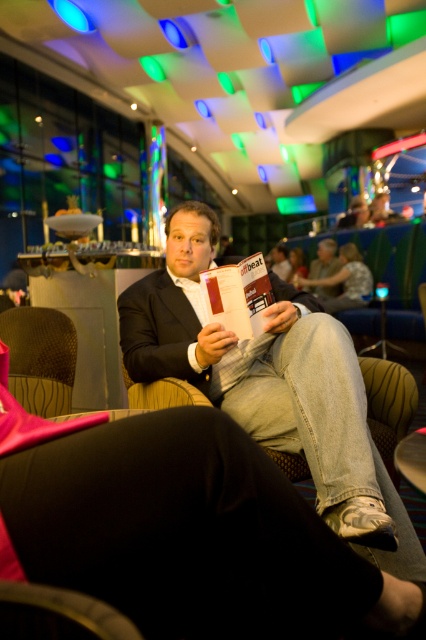
Question: Does matte black jacket at center lie in front of brown textured armchair at lower left?

Choices:
 (A) yes
 (B) no

Answer: (A)

Question: Which object is positioned closest to the red matte magazine at center?

Choices:
 (A) light brown leather jacket at center
 (B) metallic gold chair at lower left
 (C) matte black jacket at center
 (D) brown textured armchair at lower left

Answer: (C)

Question: Is brown textured armchair at lower left to the right of metallic gold chair at lower left from the viewer's perspective?

Choices:
 (A) no
 (B) yes

Answer: (A)

Question: Does metallic gold chair at lower left lie in front of light brown leather jacket at center?

Choices:
 (A) yes
 (B) no

Answer: (A)

Question: Which point is closer to the camera?

Choices:
 (A) (69, 348)
 (B) (273, 436)

Answer: (B)

Question: Which point appears farthest from the camera in this image?

Choices:
 (A) (367, 449)
 (B) (81, 595)
 (C) (60, 339)
 (D) (207, 292)

Answer: (C)